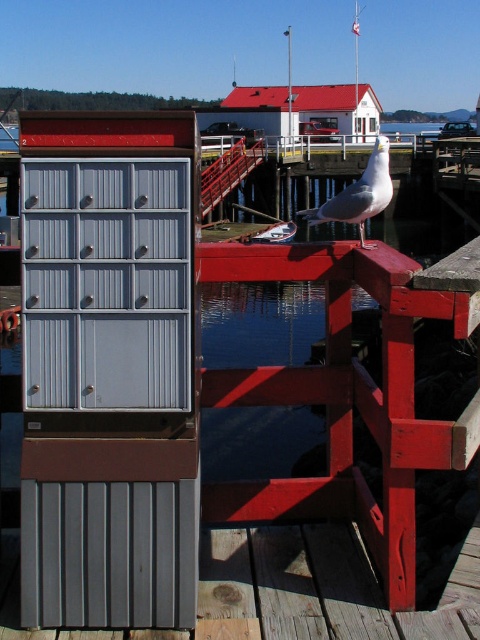
Question: Is gray plastic drawers at left closer to camera compared to white matte seagull at center?

Choices:
 (A) no
 (B) yes

Answer: (B)

Question: Which object is positioned closest to the gray plastic drawers at left?

Choices:
 (A) matte gray drawer at left
 (B) white matte seagull at center
 (C) matte gray drawers at center

Answer: (A)

Question: Does gray plastic drawers at left have a smaller size compared to gray plastic drawers at center?

Choices:
 (A) yes
 (B) no

Answer: (B)

Question: Which point is closer to the camera?

Choices:
 (A) matte gray drawer at left
 (B) matte gray drawers at center
 (C) gray plastic drawers at center

Answer: (C)

Question: Can you confirm if matte gray drawers at center is positioned below gray plastic drawers at left?

Choices:
 (A) no
 (B) yes

Answer: (B)

Question: Which point is closer to the camera taking this photo?

Choices:
 (A) (66, 369)
 (B) (178, 218)

Answer: (B)